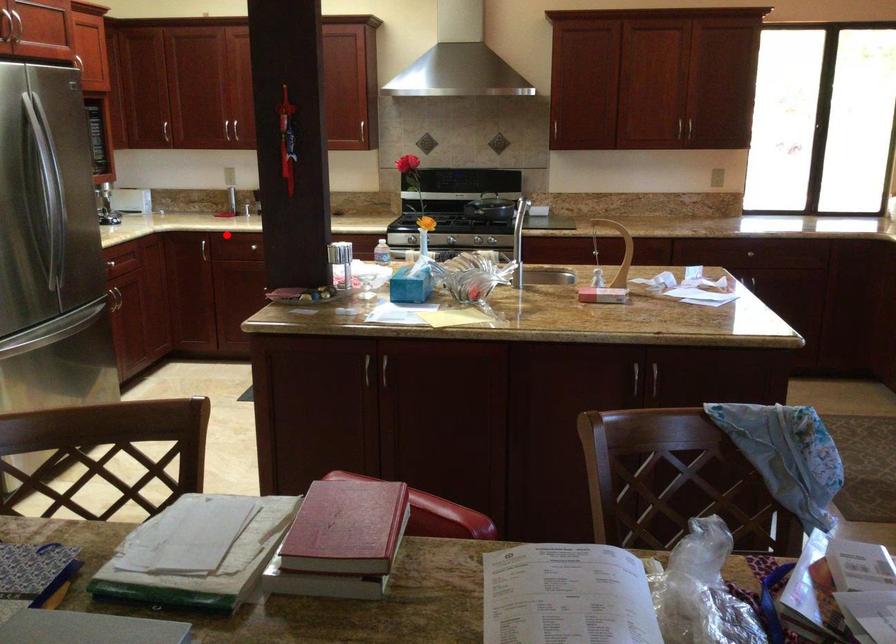
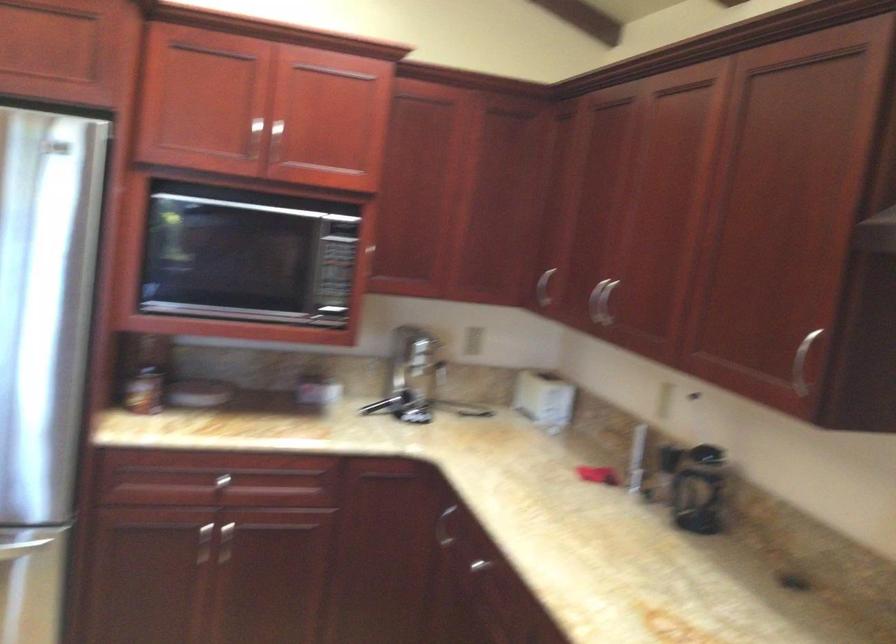
Locate, in the second image, the point that corresponds to the highlighted location in the first image.

(495, 567)